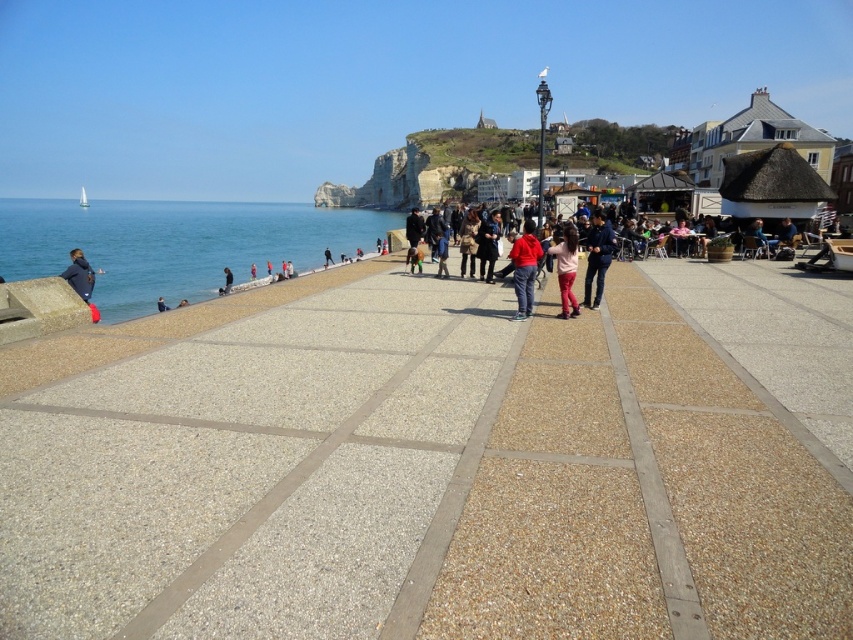
Between blue water at left and rocky cliff at upper center, which one appears on the right side from the viewer's perspective?

From the viewer's perspective, rocky cliff at upper center appears more on the right side.

Does point (120, 268) come in front of point (521, 138)?

That is True.

Locate an element on the screen. This screenshot has width=853, height=640. blue water at left is located at coordinates (175, 244).

Can you confirm if rocky cliff at upper center is wider than pink fabric pants at center?

Yes.

Between point (403, 145) and point (561, 304), which one is positioned behind?

The point (403, 145) is more distant.

Who is more forward, (601, 147) or (572, 301)?

Point (572, 301) is in front.

I want to click on rocky cliff at upper center, so click(x=434, y=168).

Describe the element at coordinates (596, 257) in the screenshot. I see `matte black jacket at center` at that location.

Can you confirm if matte black jacket at center is taller than dark blue jeans at lower left?

Yes.

You are a GUI agent. You are given a task and a screenshot of the screen. Output one action in this format:
    pyautogui.click(x=<x>, y=<y>)
    Task: Click on the matte black jacket at center
    Image resolution: width=853 pixels, height=640 pixels.
    Given the screenshot: What is the action you would take?
    pyautogui.click(x=596, y=257)